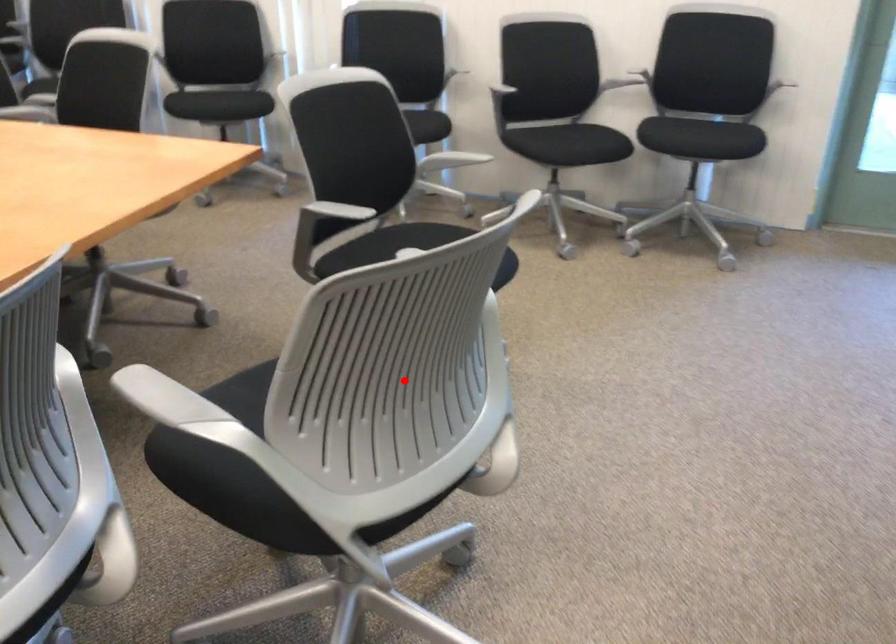
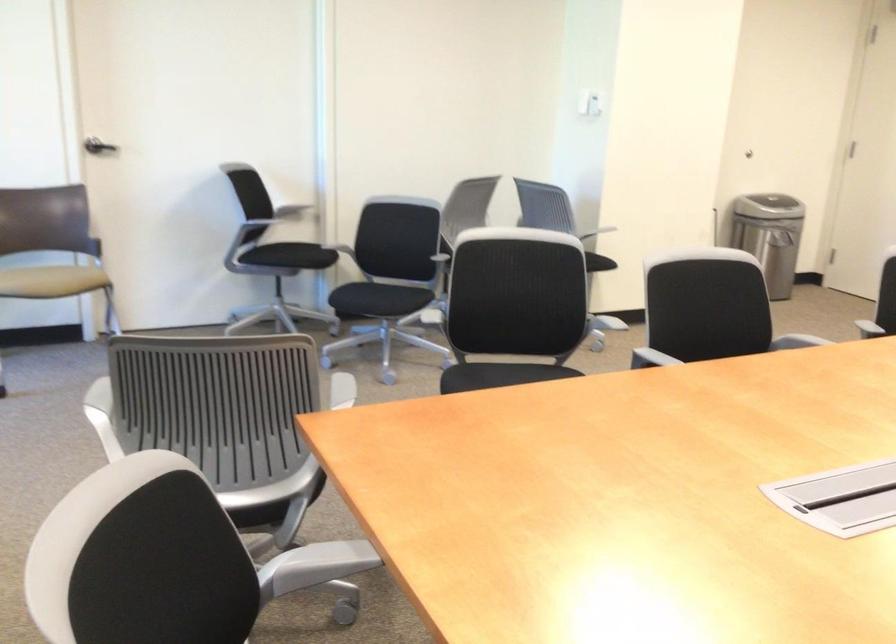
Question: A red point is marked in image1. In image2, is the corresponding 3D point closer to the camera or farther? Reply with the corresponding letter.

Choices:
 (A) The corresponding 3D point is closer.
 (B) The corresponding 3D point is farther.

Answer: (B)